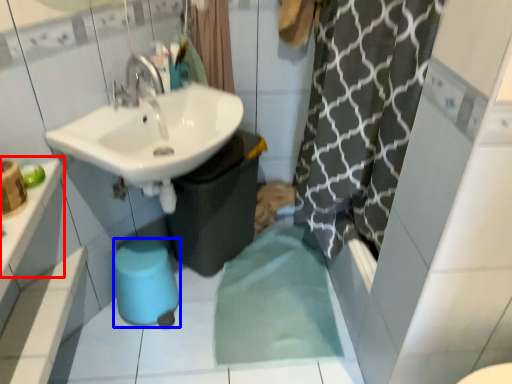
Question: Which object is further to the camera taking this photo, counter top (highlighted by a red box) or bidet (highlighted by a blue box)?

Choices:
 (A) counter top
 (B) bidet

Answer: (B)